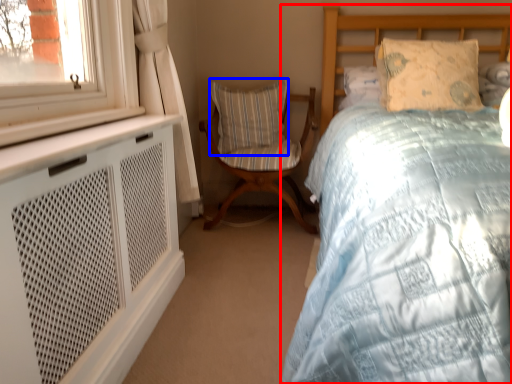
Question: Which of the following is the farthest to the observer, bed (highlighted by a red box) or pillow (highlighted by a blue box)?

Choices:
 (A) bed
 (B) pillow

Answer: (B)